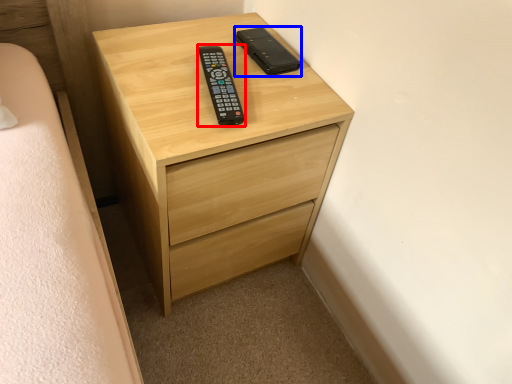
Question: Which point is closer to the camera, control (highlighted by a red box) or control (highlighted by a blue box)?

Choices:
 (A) control
 (B) control

Answer: (A)